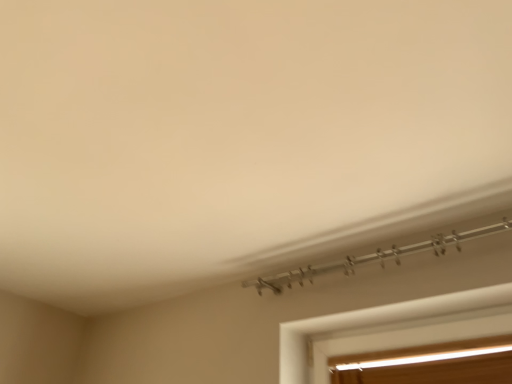
Question: Is clear glass window at lower right, the second window in the top-to-bottom sequence, positioned behind white matte window at lower right, which ranks as the second window in bottom-to-top order?

Choices:
 (A) yes
 (B) no

Answer: (A)

Question: Considering the relative sizes of clear glass window at lower right, which ranks as the 1th window in bottom-to-top order, and white matte window at lower right, which ranks as the second window in bottom-to-top order, in the image provided, is clear glass window at lower right, which ranks as the 1th window in bottom-to-top order, smaller than white matte window at lower right, which ranks as the second window in bottom-to-top order,?

Choices:
 (A) no
 (B) yes

Answer: (A)

Question: Considering the relative sizes of clear glass window at lower right, the second window in the top-to-bottom sequence, and white matte window at lower right, which ranks as the second window in bottom-to-top order, in the image provided, is clear glass window at lower right, the second window in the top-to-bottom sequence, thinner than white matte window at lower right, which ranks as the second window in bottom-to-top order,?

Choices:
 (A) yes
 (B) no

Answer: (A)

Question: Does clear glass window at lower right, which ranks as the 1th window in bottom-to-top order, have a greater width compared to white matte window at lower right, the 1th window in the top-to-bottom sequence?

Choices:
 (A) yes
 (B) no

Answer: (B)

Question: From the image's perspective, is clear glass window at lower right, which ranks as the 1th window in bottom-to-top order, located above white matte window at lower right, the 1th window in the top-to-bottom sequence?

Choices:
 (A) yes
 (B) no

Answer: (B)

Question: Considering the relative sizes of clear glass window at lower right, which ranks as the 1th window in bottom-to-top order, and white matte window at lower right, which ranks as the second window in bottom-to-top order, in the image provided, is clear glass window at lower right, which ranks as the 1th window in bottom-to-top order, shorter than white matte window at lower right, which ranks as the second window in bottom-to-top order,?

Choices:
 (A) no
 (B) yes

Answer: (A)

Question: Is the position of white matte window at lower right, which ranks as the second window in bottom-to-top order, more distant than that of clear glass window at lower right, the second window in the top-to-bottom sequence?

Choices:
 (A) yes
 (B) no

Answer: (B)

Question: Is white matte window at lower right, the 1th window in the top-to-bottom sequence, looking in the opposite direction of clear glass window at lower right, the second window in the top-to-bottom sequence?

Choices:
 (A) no
 (B) yes

Answer: (A)

Question: Does white matte window at lower right, which ranks as the second window in bottom-to-top order, have a greater height compared to clear glass window at lower right, the second window in the top-to-bottom sequence?

Choices:
 (A) yes
 (B) no

Answer: (B)

Question: From the image's perspective, is white matte window at lower right, the 1th window in the top-to-bottom sequence, under clear glass window at lower right, which ranks as the 1th window in bottom-to-top order?

Choices:
 (A) yes
 (B) no

Answer: (B)

Question: From a real-world perspective, does white matte window at lower right, which ranks as the second window in bottom-to-top order, sit lower than clear glass window at lower right, which ranks as the 1th window in bottom-to-top order?

Choices:
 (A) no
 (B) yes

Answer: (A)

Question: Is white matte window at lower right, which ranks as the second window in bottom-to-top order, positioned before clear glass window at lower right, which ranks as the 1th window in bottom-to-top order?

Choices:
 (A) yes
 (B) no

Answer: (A)

Question: In the image, is white matte window at lower right, which ranks as the second window in bottom-to-top order, on the left side or the right side of clear glass window at lower right, the second window in the top-to-bottom sequence?

Choices:
 (A) left
 (B) right

Answer: (A)